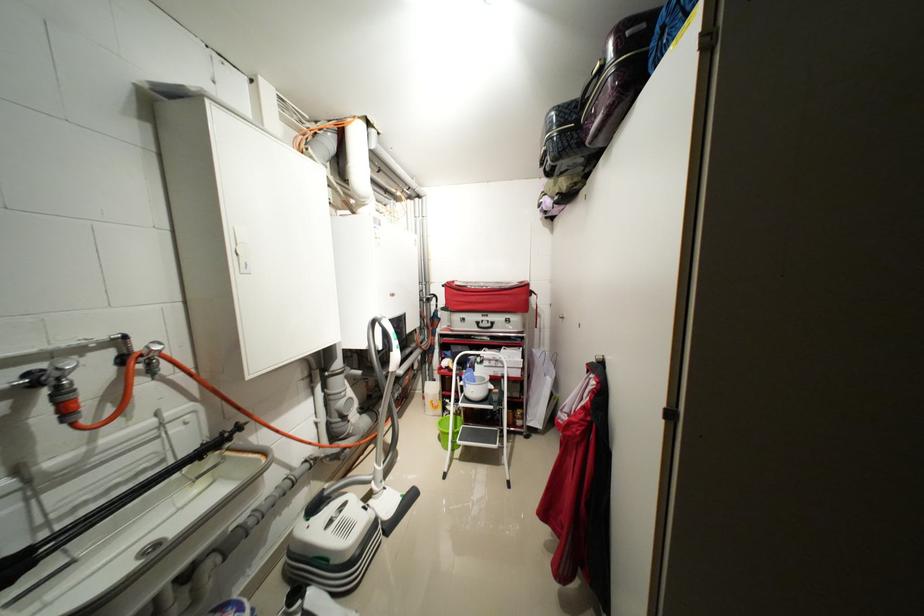
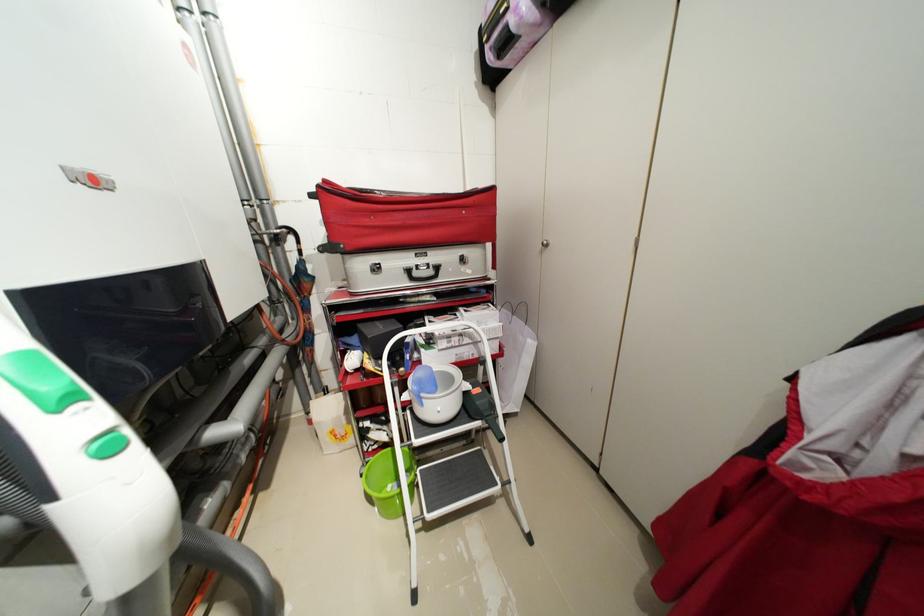
Find the pixel in the second image that matches (504,391) in the first image.

(484, 391)